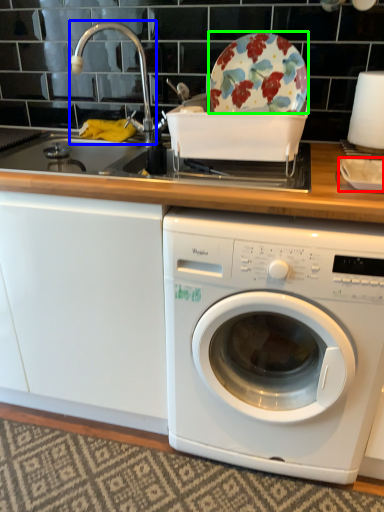
Question: Which is farther away from tableware (highlighted by a red box)? faucet (highlighted by a blue box) or table (highlighted by a green box)?

Choices:
 (A) faucet
 (B) table

Answer: (A)